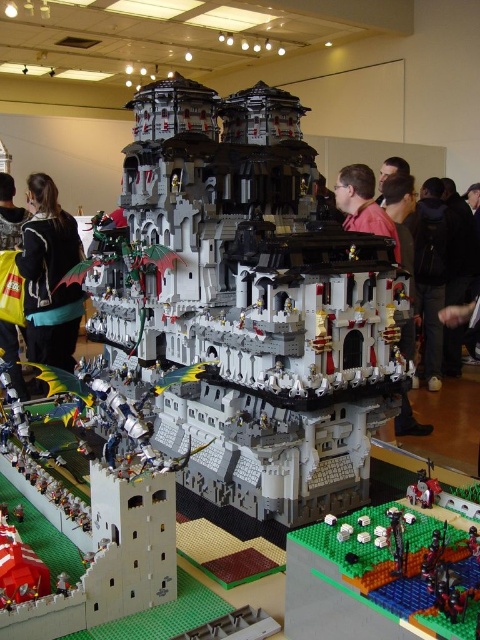
Is black fabric jacket at left wider than yellow fabric bag at lower left?

Yes, black fabric jacket at left is wider than yellow fabric bag at lower left.

How far apart are black fabric jacket at left and yellow fabric bag at lower left?

black fabric jacket at left is 17.83 inches away from yellow fabric bag at lower left.

The image size is (480, 640). Describe the element at coordinates (49, 276) in the screenshot. I see `black fabric jacket at left` at that location.

The height and width of the screenshot is (640, 480). I want to click on black fabric jacket at left, so click(x=49, y=276).

Based on the photo, can you confirm if white matte castle at center is taller than black fabric jacket at left?

No, white matte castle at center is not taller than black fabric jacket at left.

Which is in front, point (339, 440) or point (72, 225)?

Point (339, 440)

I want to click on white matte castle at center, so click(x=254, y=304).

At what (x,y) coordinates should I click in order to perform the action: click on white matte castle at center. Please return your answer as a coordinate pair (x, y). Looking at the image, I should click on (254, 304).

Does point (296, 305) lie in front of point (20, 218)?

Yes, point (296, 305) is closer to viewer.

Does white matte castle at center have a lesser height compared to yellow fabric bag at lower left?

No, white matte castle at center is not shorter than yellow fabric bag at lower left.

You are a GUI agent. You are given a task and a screenshot of the screen. Output one action in this format:
    pyautogui.click(x=<x>, y=<y>)
    Task: Click on the white matte castle at center
    This screenshot has height=640, width=480.
    Given the screenshot: What is the action you would take?
    pyautogui.click(x=254, y=304)